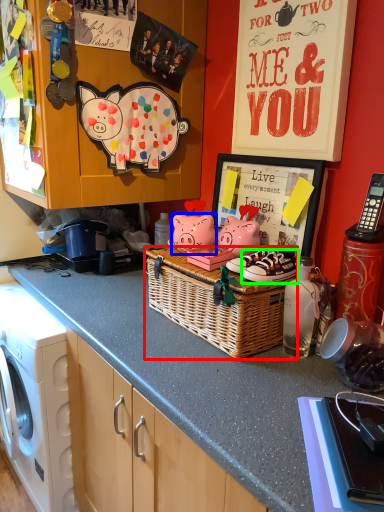
Question: Considering the real-world distances, which object is closest to picnic basket (highlighted by a red box)? pig (highlighted by a blue box) or footwear (highlighted by a green box).

Choices:
 (A) pig
 (B) footwear

Answer: (B)